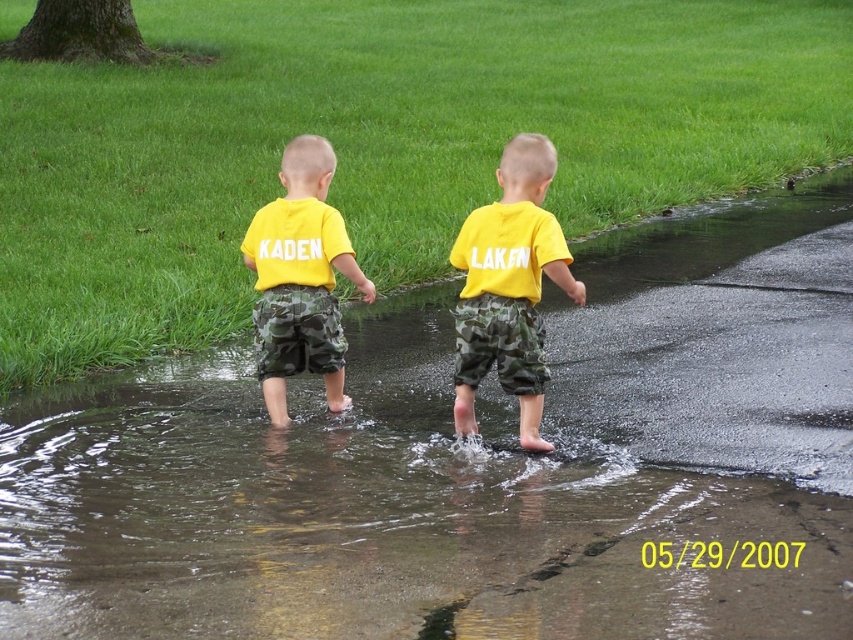
Question: Is clear water at puddle center positioned behind matte yellow t-shirt at center?

Choices:
 (A) no
 (B) yes

Answer: (A)

Question: Which object is closer to the camera taking this photo?

Choices:
 (A) yellow matte shirt at center
 (B) clear water at puddle center

Answer: (B)

Question: Which point appears farthest from the camera in this image?

Choices:
 (A) (338, 250)
 (B) (503, 168)
 (C) (635, 477)

Answer: (A)

Question: Is yellow matte shirt at center to the left of matte yellow t-shirt at center from the viewer's perspective?

Choices:
 (A) no
 (B) yes

Answer: (A)

Question: Among these objects, which one is farthest from the camera?

Choices:
 (A) yellow matte shirt at center
 (B) clear water at puddle center

Answer: (A)

Question: Is clear water at puddle center to the left of matte yellow t-shirt at center from the viewer's perspective?

Choices:
 (A) yes
 (B) no

Answer: (B)